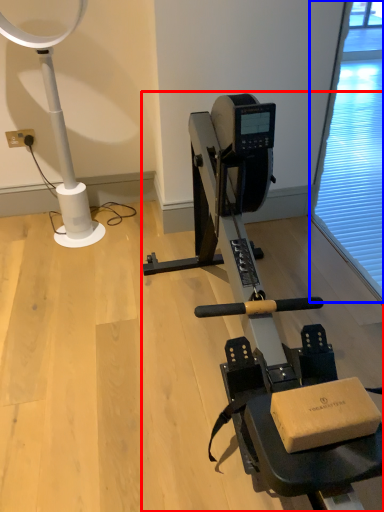
Question: Which object appears farthest to the camera in this image, stationary bicycle (highlighted by a red box) or screen door (highlighted by a blue box)?

Choices:
 (A) stationary bicycle
 (B) screen door

Answer: (B)